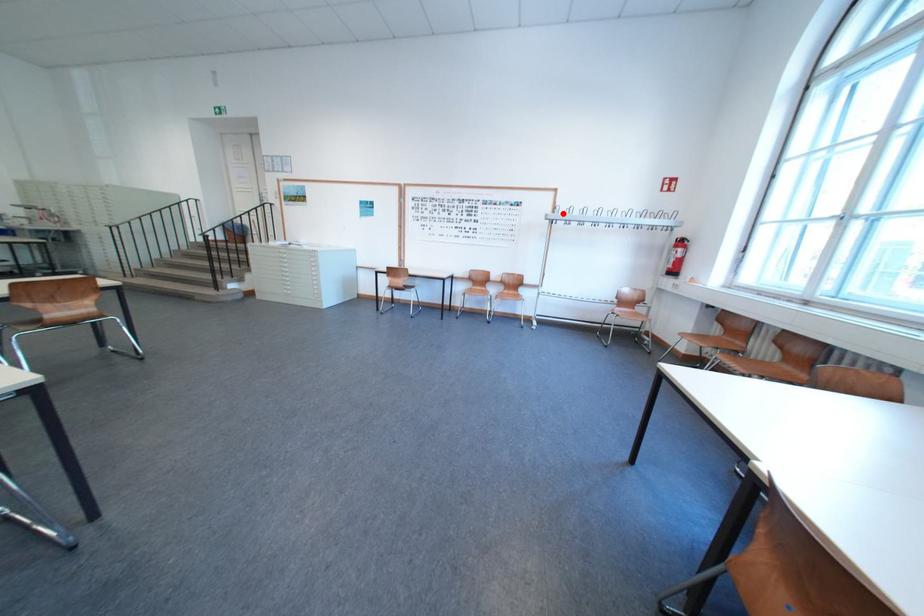
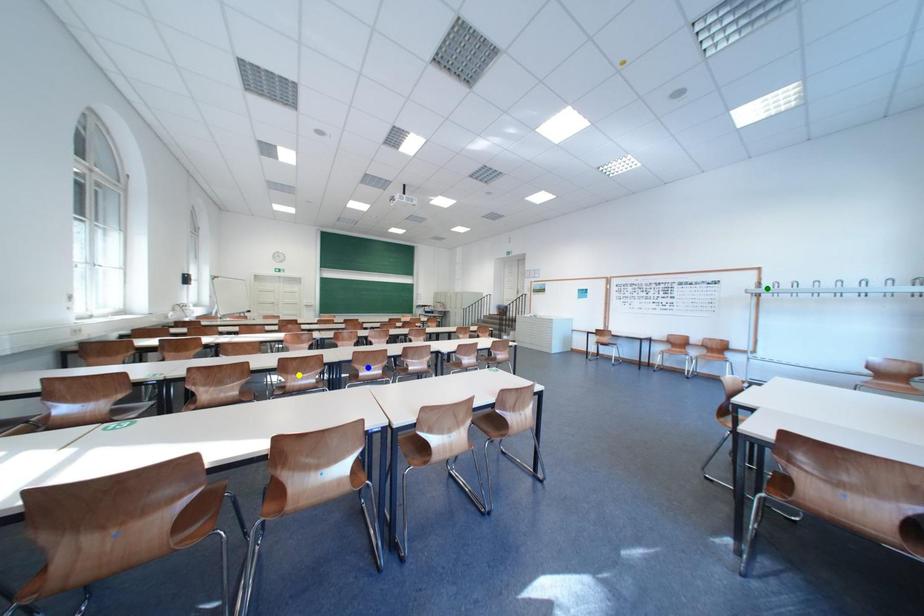
Question: I am providing you with two images of the same scene from different viewpoints. A red point is marked on the first image. You are given multiple points on the second image. Which spot in image 2 lines up with the point in image 1?

Choices:
 (A) yellow point
 (B) blue point
 (C) green point

Answer: (C)